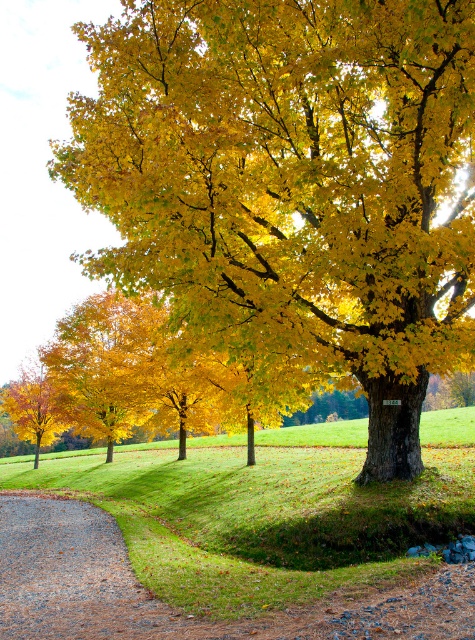
You are planning to place a 3 meter wide garden bench along the gravelly dirt path at lower left. Considering the size of the golden matte tree at center, will there be enough space on the path to place the bench without it being under the tree?

The golden matte tree at center is bigger than the gravelly dirt path at lower left, so placing a 3 meter wide bench might not leave enough space on the path since the path itself is narrower than the tree.

You are a gardener who needs to water the golden matte tree at center. You have a hose that can reach 7 meters. You are currently standing at the gravelly dirt path at lower left. Can you water the tree without moving the hose? Please explain your reasoning based on the distance between them.

The golden matte tree at center and gravelly dirt path at lower left are 7.35 meters apart. Since the hose can only reach 7 meters, the distance is too great. You would need to move closer or use a longer hose to water the tree.

Consider the image. You are standing on the gravelly dirt path at lower left and want to walk towards the golden matte tree at center. Which direction should you head?

You should head to the right because the golden matte tree at center is to the left of the gravelly dirt path at lower left, so moving right will take you towards it.